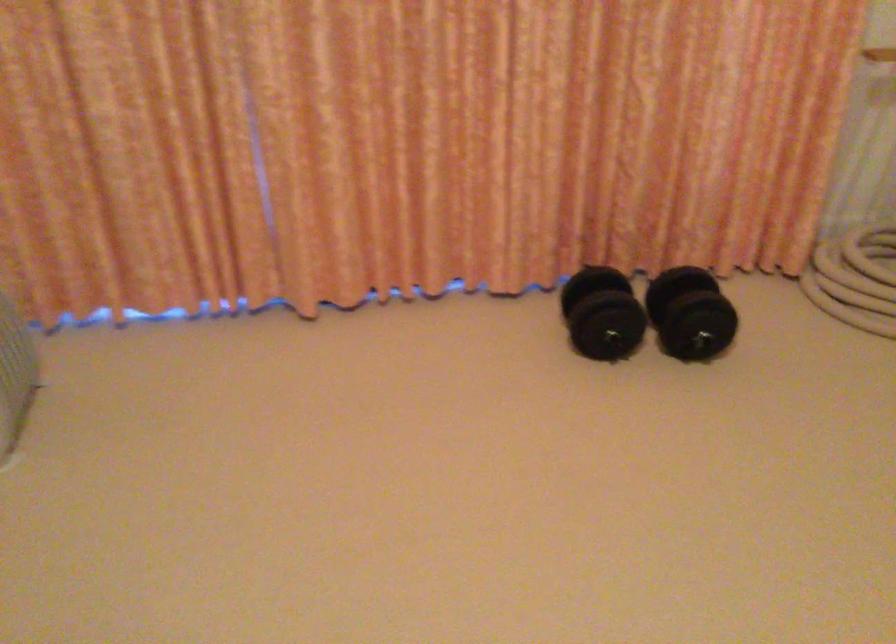
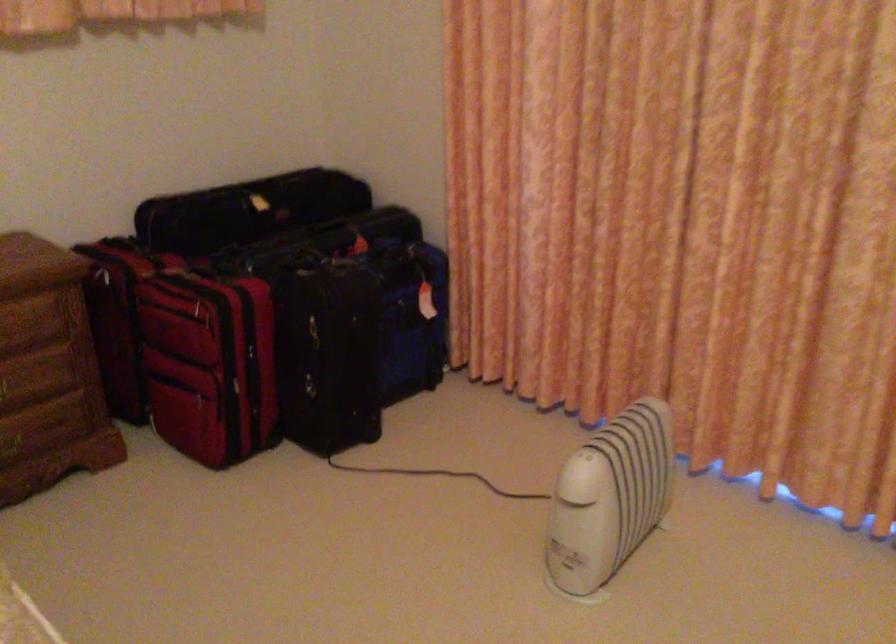
Question: The images are taken continuously from a first-person perspective. In which direction is your viewpoint rotating?

Choices:
 (A) Left
 (B) Right
 (C) Up
 (D) Down

Answer: (A)